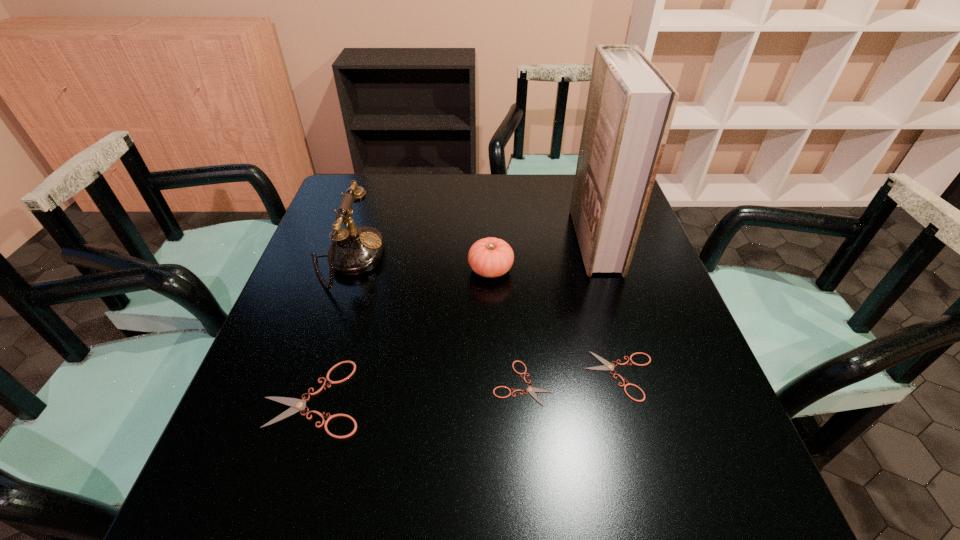
At what (x,y) coordinates should I click in order to perform the action: click on telephone that is at the left edge. Please return your answer as a coordinate pair (x, y). This screenshot has width=960, height=540. Looking at the image, I should click on (356, 250).

The image size is (960, 540). In order to click on shears located at the right edge in this screenshot , I will do `click(607, 365)`.

The width and height of the screenshot is (960, 540). Identify the location of phonebook that is at the right edge. point(630,107).

Find the location of a particular element. Image resolution: width=960 pixels, height=540 pixels. object located in the near left corner section of the desktop is located at coordinates (297, 405).

The width and height of the screenshot is (960, 540). Identify the location of object present at the far right corner. (630, 107).

Where is `vacant space at the far edge of the desktop`? vacant space at the far edge of the desktop is located at coordinates (569, 181).

Find the location of a particular element. vacant space at the near edge is located at coordinates (388, 442).

You are a GUI agent. You are given a task and a screenshot of the screen. Output one action in this format:
    pyautogui.click(x=<x>, y=<y>)
    Task: Click on the free spot at the left edge of the desktop
    
    Given the screenshot: What is the action you would take?
    pyautogui.click(x=309, y=284)

Locate an element on the screen. Image resolution: width=960 pixels, height=540 pixels. free spot at the right edge of the desktop is located at coordinates (644, 322).

What are the coordinates of `free space at the far left corner of the desktop` in the screenshot? It's located at (350, 178).